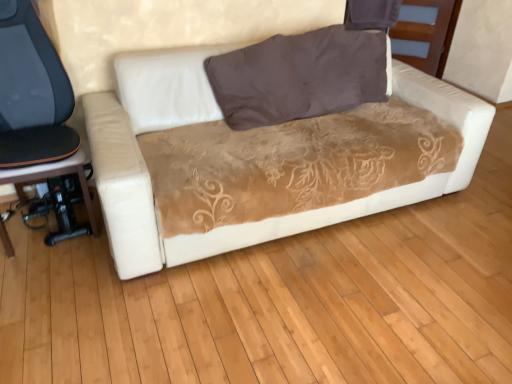
Question: Based on their positions, is black plastic music stool at lower left located to the left or right of brown velvety pillow at upper center?

Choices:
 (A) left
 (B) right

Answer: (A)

Question: Is point (34, 175) closer or farther from the camera than point (283, 79)?

Choices:
 (A) closer
 (B) farther

Answer: (A)

Question: Based on their relative distances, which object is nearer to the black plastic music stool at lower left?

Choices:
 (A) velvet brown couch at center
 (B) black leather chair at left
 (C) brown velvety pillow at upper center

Answer: (B)

Question: Which is farther from the brown velvety pillow at upper center?

Choices:
 (A) black plastic music stool at lower left
 (B) velvet brown couch at center
 (C) black leather chair at left

Answer: (A)